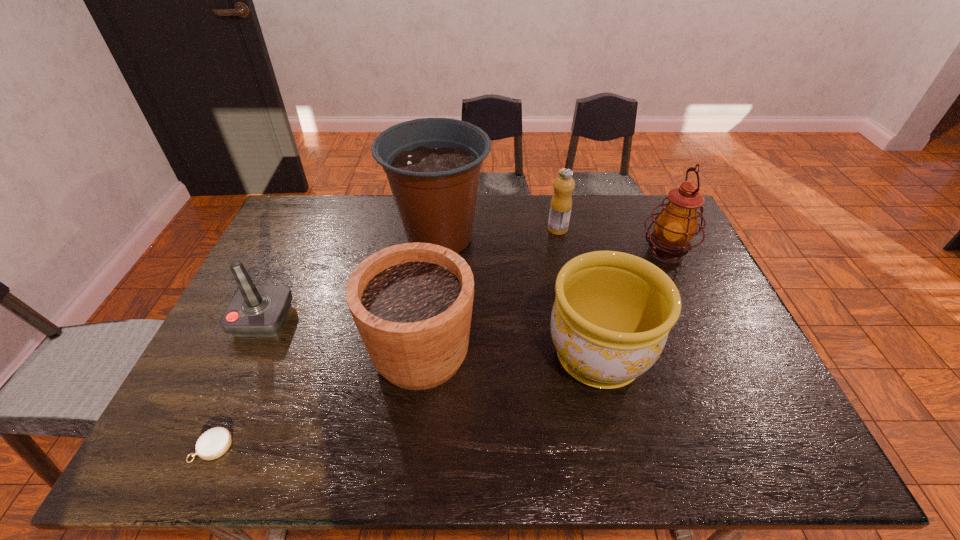
You are a GUI agent. You are given a task and a screenshot of the screen. Output one action in this format:
    pyautogui.click(x=<x>, y=<y>)
    Task: Click on the compass that is at the left edge
    This screenshot has height=540, width=960.
    Given the screenshot: What is the action you would take?
    pyautogui.click(x=212, y=444)

Find the location of `object that is at the right edge`. object that is at the right edge is located at coordinates (676, 225).

You are a GUI agent. You are given a task and a screenshot of the screen. Output one action in this format:
    pyautogui.click(x=<x>, y=<y>)
    Task: Click on the object that is at the near left corner
    
    Given the screenshot: What is the action you would take?
    pyautogui.click(x=212, y=444)

Where is `object located at the far right corner`? This screenshot has width=960, height=540. object located at the far right corner is located at coordinates (676, 225).

In order to click on free space at the far edge of the desktop in this screenshot , I will do [484, 232].

Locate an element on the screen. vacant space at the near edge of the desktop is located at coordinates (248, 427).

In the image, there is a desktop. At what (x,y) coordinates should I click in order to perform the action: click on vacant region at the right edge. Please return your answer as a coordinate pair (x, y). The height and width of the screenshot is (540, 960). Looking at the image, I should click on (702, 278).

Image resolution: width=960 pixels, height=540 pixels. In the image, there is a desktop. Identify the location of free space at the far left corner. (299, 204).

Find the location of `vacant space at the far right corner of the desktop`. vacant space at the far right corner of the desktop is located at coordinates (634, 226).

Find the location of `free space that is in between the rightmost object and the fruit juice`. free space that is in between the rightmost object and the fruit juice is located at coordinates (612, 241).